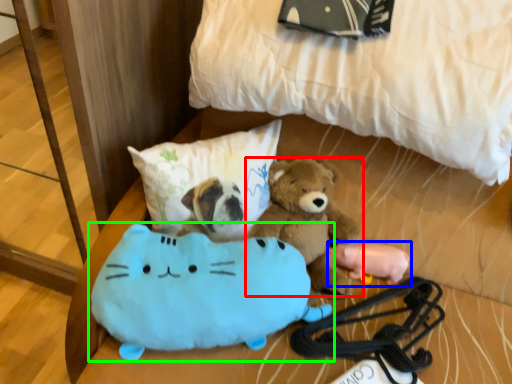
Question: Considering the real-world distances, which object is closest to teddy bear (highlighted by a red box)? toy (highlighted by a blue box) or toy (highlighted by a green box).

Choices:
 (A) toy
 (B) toy

Answer: (A)